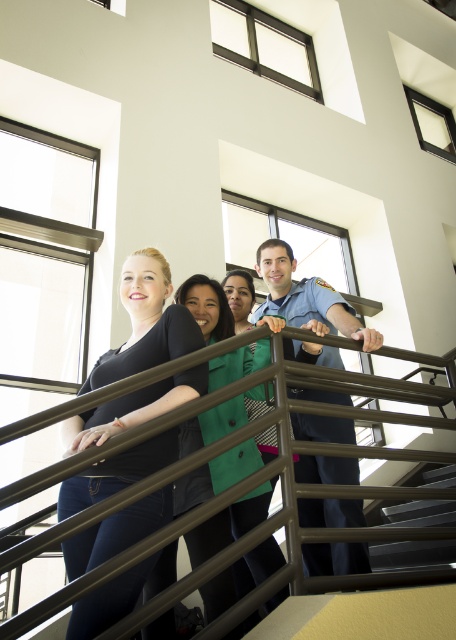
Looking at this image, you are a photographer setting up a shoot in this scene. You need to ensure that the black matte shirt at center and the blue uniform at center are both visible in the frame. Given their sizes, which object should you focus on to ensure both are in focus?

The black matte shirt at center has a smaller size compared to the blue uniform at center. To ensure both are in focus, focus on the larger object, the blue uniform at center, as it will require more attention to detail.

You are standing on the metallic gray stairs at lower right and want to reach the metallic brown railing at center. In which direction should you move?

You should move to the left to reach the metallic brown railing at center since it is located to the left of the metallic gray stairs at lower right.